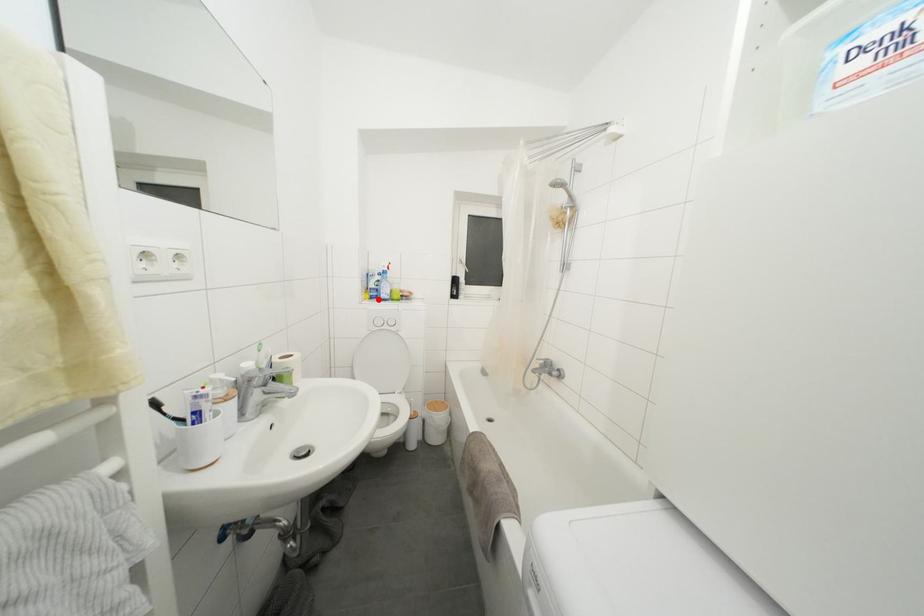
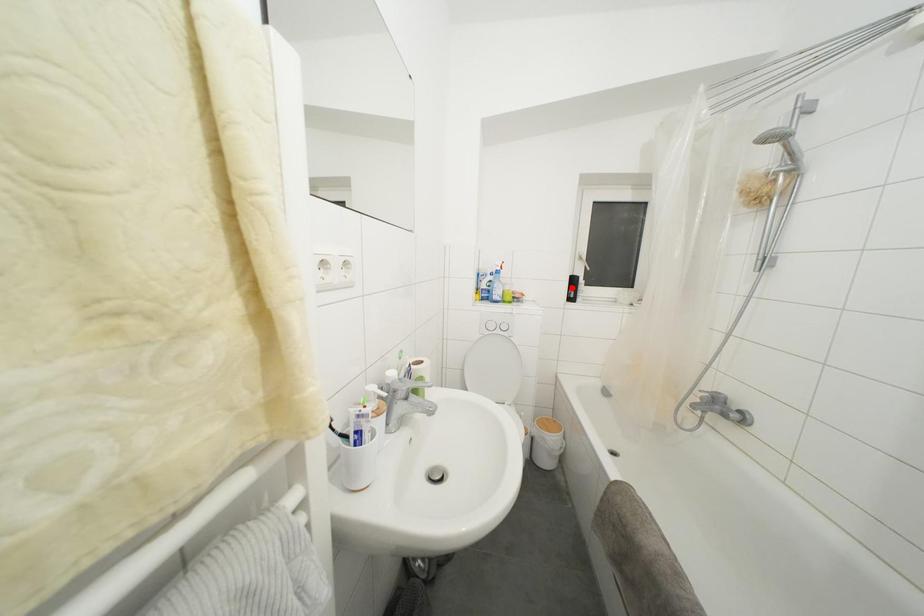
I am providing you with two images of the same scene from different viewpoints. A red point is marked on the first image and another point is marked on the second image. Is the red point in image1 aligned with the point shown in image2?

No